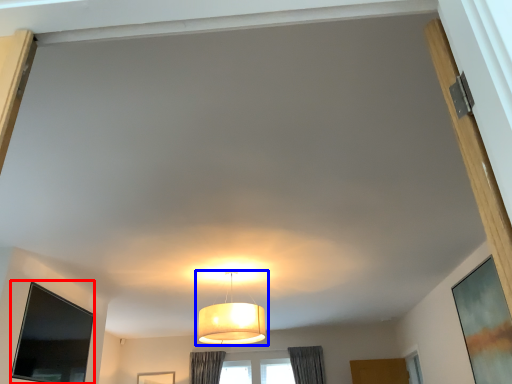
Question: Which object appears farthest to the camera in this image, window screen (highlighted by a red box) or lamp (highlighted by a blue box)?

Choices:
 (A) window screen
 (B) lamp

Answer: (B)